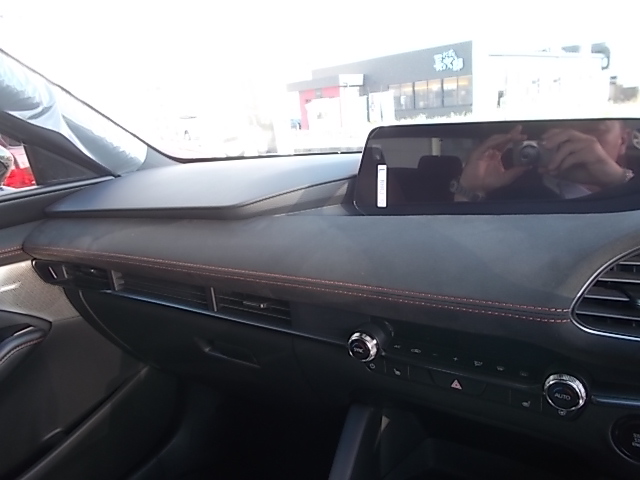
Where is `door handle`? door handle is located at coordinates (22, 350).